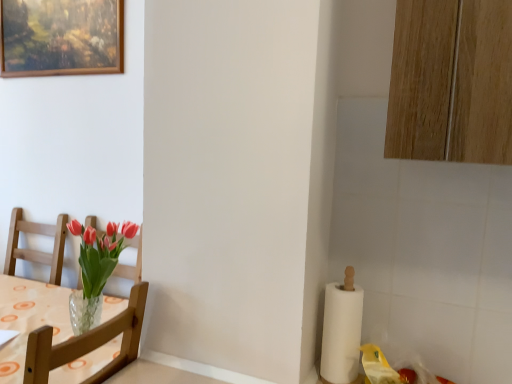
Question: Is white paper at right oriented away from wooden chair at left?

Choices:
 (A) no
 (B) yes

Answer: (A)

Question: Does white paper at right come behind wooden chair at left?

Choices:
 (A) yes
 (B) no

Answer: (A)

Question: Does white paper at right have a greater width compared to wooden chair at left?

Choices:
 (A) no
 (B) yes

Answer: (A)

Question: Is white paper at right at the left side of wooden chair at left?

Choices:
 (A) no
 (B) yes

Answer: (A)

Question: Would you say wooden chair at left is part of white paper at right's contents?

Choices:
 (A) no
 (B) yes

Answer: (A)

Question: From the image's perspective, would you say white paper at right is positioned over wooden chair at left?

Choices:
 (A) no
 (B) yes

Answer: (B)

Question: From the image's perspective, does white paper at right appear lower than wooden-framed painting at upper left?

Choices:
 (A) yes
 (B) no

Answer: (A)

Question: Can you confirm if white paper at right is taller than wooden-framed painting at upper left?

Choices:
 (A) yes
 (B) no

Answer: (B)

Question: Considering the relative sizes of white paper at right and wooden-framed painting at upper left in the image provided, is white paper at right thinner than wooden-framed painting at upper left?

Choices:
 (A) no
 (B) yes

Answer: (A)

Question: Is wooden-framed painting at upper left completely or partially inside white paper at right?

Choices:
 (A) no
 (B) yes

Answer: (A)

Question: Is white paper at right to the left of wooden-framed painting at upper left from the viewer's perspective?

Choices:
 (A) no
 (B) yes

Answer: (A)

Question: Can you confirm if white paper at right is shorter than wooden-framed painting at upper left?

Choices:
 (A) yes
 (B) no

Answer: (A)

Question: Is wooden-framed painting at upper left at the right side of wooden chair at left?

Choices:
 (A) no
 (B) yes

Answer: (A)